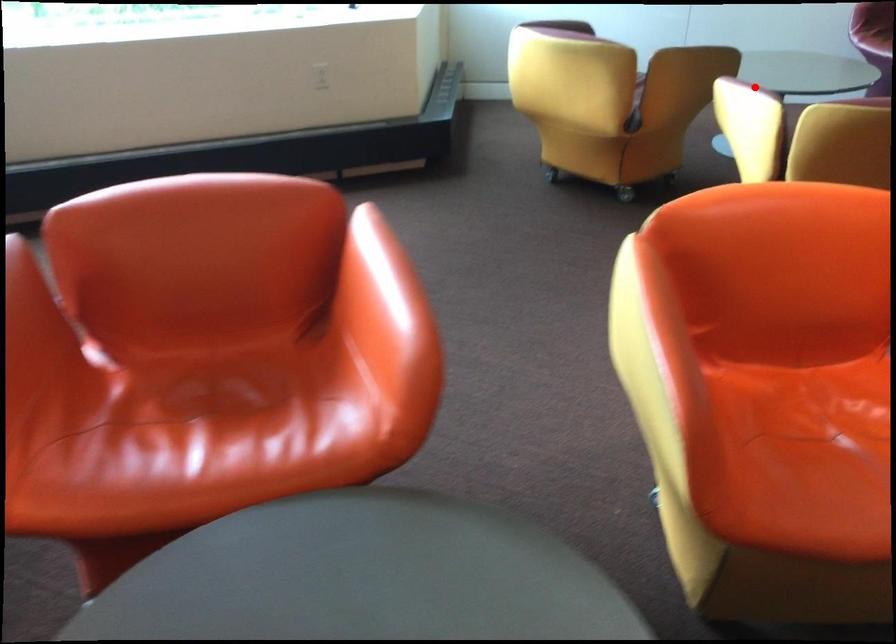
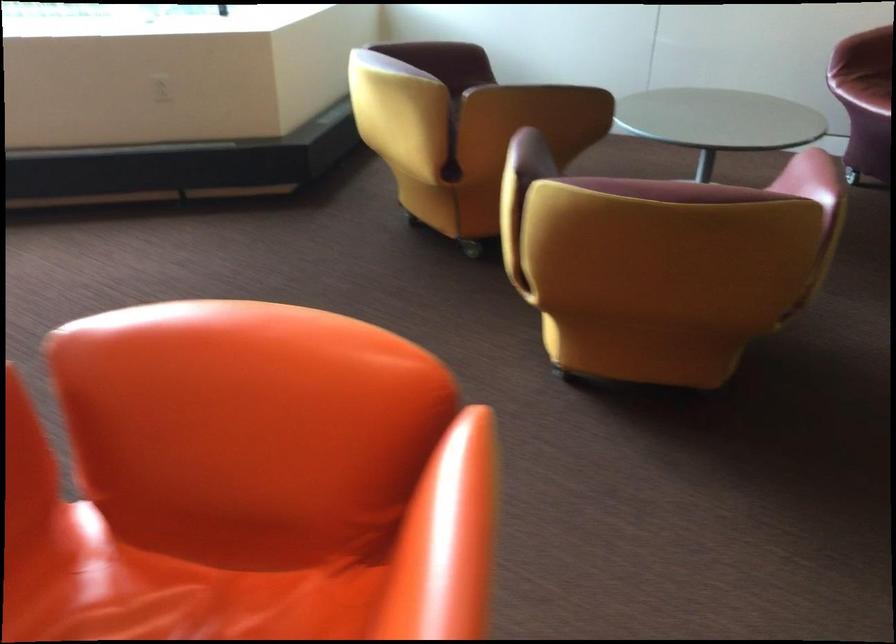
Question: I am providing you with two images of the same scene from different viewpoints. A red point is marked on the first image. Is the red point's position out of view in image 2?

Choices:
 (A) Yes
 (B) No

Answer: (A)